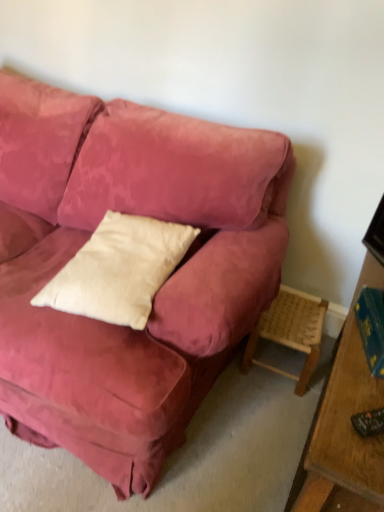
Question: Is hardcover book at right closer to camera compared to white cotton pillow at center?

Choices:
 (A) no
 (B) yes

Answer: (A)

Question: Can you see hardcover book at right touching white cotton pillow at center?

Choices:
 (A) no
 (B) yes

Answer: (A)

Question: Can white cotton pillow at center be found inside hardcover book at right?

Choices:
 (A) yes
 (B) no

Answer: (B)

Question: Is hardcover book at right wider than white cotton pillow at center?

Choices:
 (A) no
 (B) yes

Answer: (A)

Question: Does hardcover book at right have a larger size compared to white cotton pillow at center?

Choices:
 (A) no
 (B) yes

Answer: (A)

Question: Is hardcover book at right shorter than white cotton pillow at center?

Choices:
 (A) yes
 (B) no

Answer: (A)

Question: Could white cotton pillow at center be considered to be inside woven wood stool at lower right?

Choices:
 (A) yes
 (B) no

Answer: (B)

Question: Is woven wood stool at lower right thinner than white cotton pillow at center?

Choices:
 (A) yes
 (B) no

Answer: (A)

Question: Is woven wood stool at lower right smaller than white cotton pillow at center?

Choices:
 (A) no
 (B) yes

Answer: (B)

Question: Considering the relative sizes of woven wood stool at lower right and white cotton pillow at center in the image provided, is woven wood stool at lower right wider than white cotton pillow at center?

Choices:
 (A) no
 (B) yes

Answer: (A)

Question: From a real-world perspective, is woven wood stool at lower right positioned over white cotton pillow at center based on gravity?

Choices:
 (A) yes
 (B) no

Answer: (B)

Question: From the image's perspective, does woven wood stool at lower right appear lower than white cotton pillow at center?

Choices:
 (A) no
 (B) yes

Answer: (B)

Question: Is hardcover book at right completely or partially outside of woven wood stool at lower right?

Choices:
 (A) yes
 (B) no

Answer: (A)